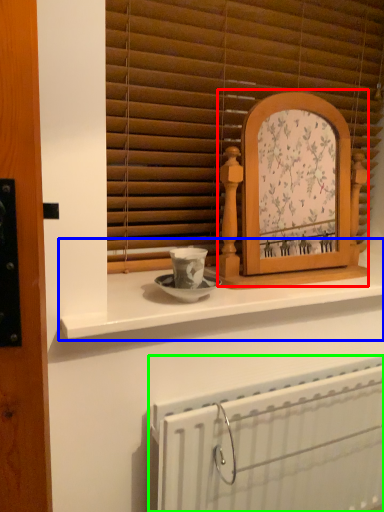
Question: Estimate the real-world distances between objects in this image. Which object is closer to picture frame (highlighted by a red box), counter (highlighted by a blue box) or radiator (highlighted by a green box)?

Choices:
 (A) counter
 (B) radiator

Answer: (A)